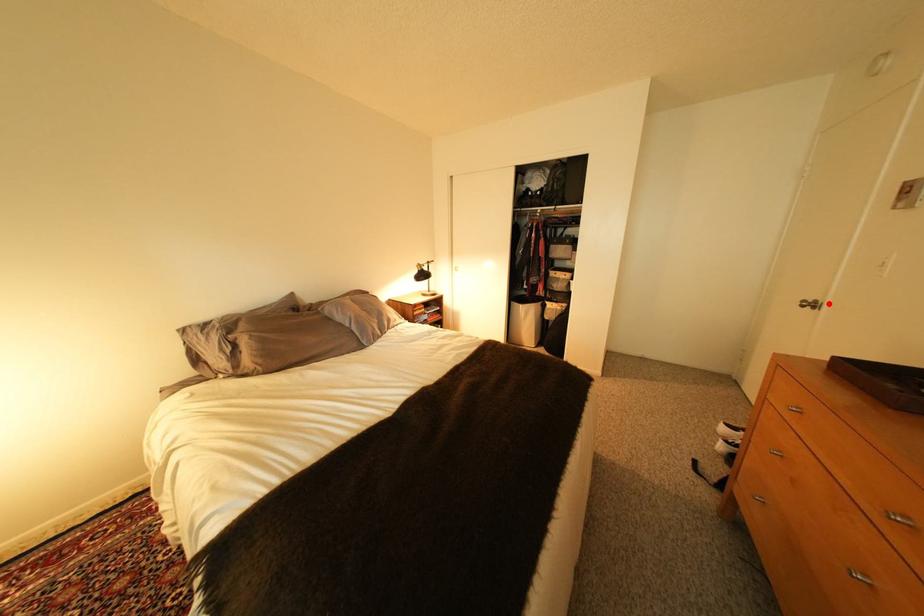
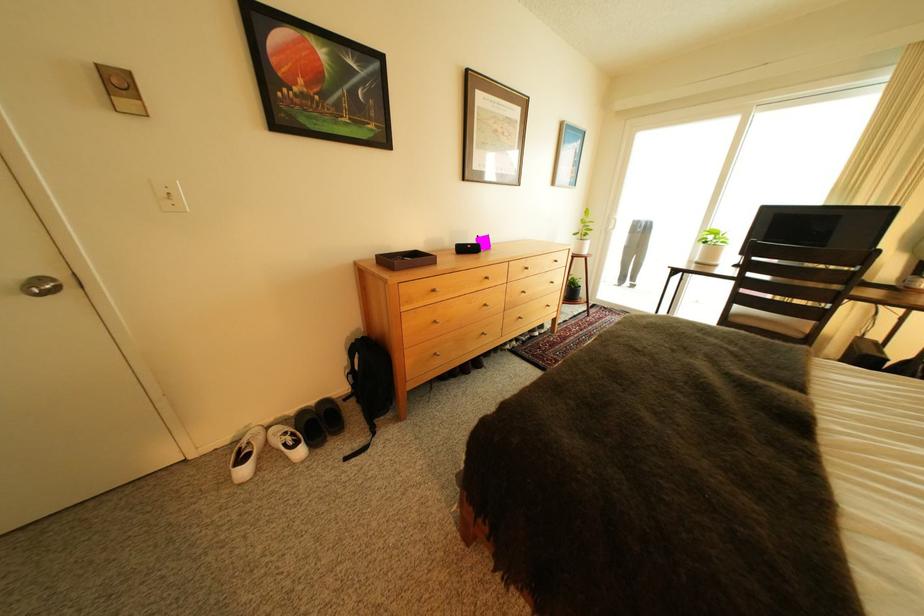
Find the pixel in the second image that matches the highlighted location in the first image.

(55, 281)